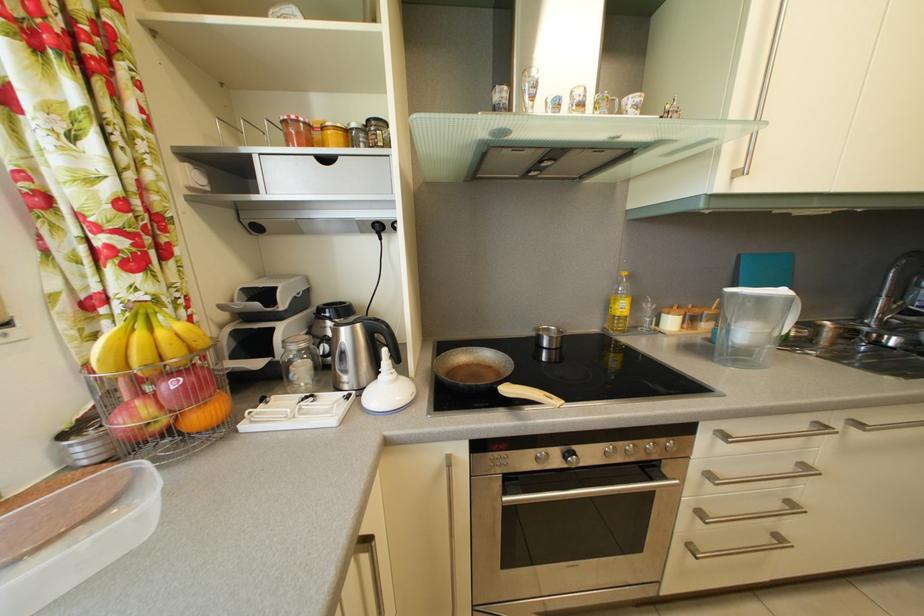
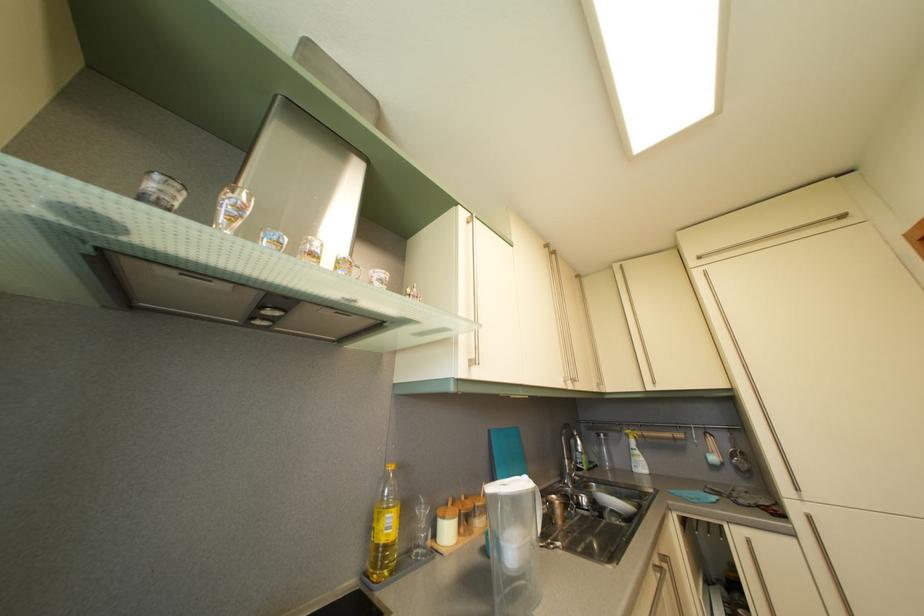
Find the pixel in the second image that matches the point at 538,179 in the first image.

(261, 326)